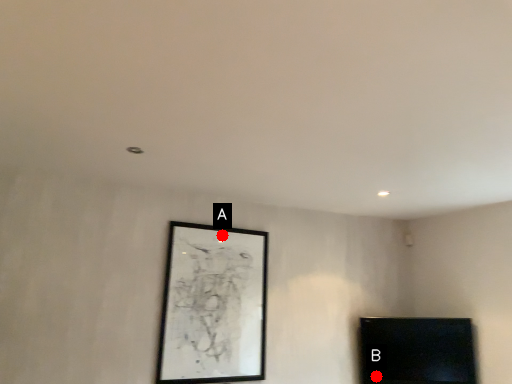
Question: Two points are circled on the image, labeled by A and B beside each circle. Which of the following is the farthest from the observer?

Choices:
 (A) A is further
 (B) B is further

Answer: (B)